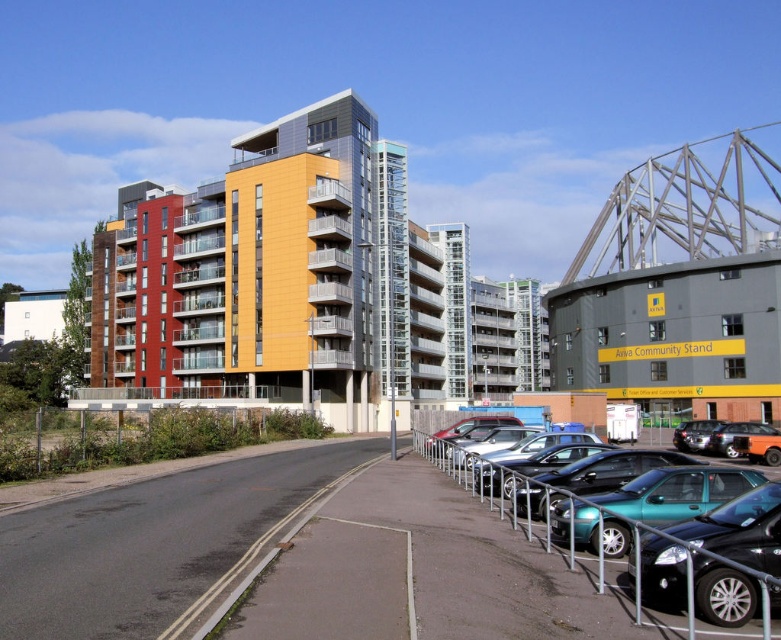
You are standing in the urban scene and want to determine which of the two points, point (712, 481) or point (679, 442), is closer to you. Based on the image, which point is nearer?

Point (712, 481) is closer to the viewer than point (679, 442).

You are a delivery driver who needs to park your teal metallic car at center in a parking spot that is only accessible if it is positioned above the shiny black sedan at center. According to the scene, can you park your car there?

The teal metallic car at center is located above the shiny black sedan at center, so yes, you can park your teal metallic car at center there as it meets the requirement of being positioned above the shiny black sedan at center.

Looking at this image, you are standing at point (662,497) in the urban scene. What object is located exactly at your current position?

The teal metallic car at center is located exactly at point (662,497).